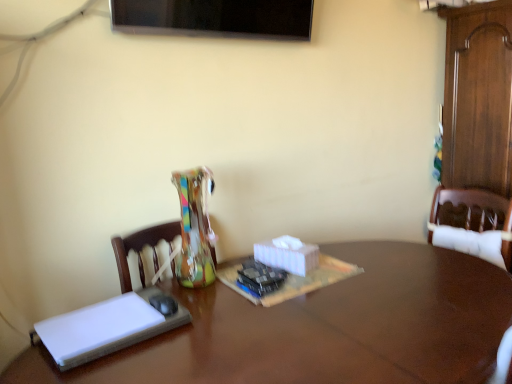
This screenshot has width=512, height=384. Find the location of `empty space that is ontop of white matte book at left (from a real-world perspective)`. empty space that is ontop of white matte book at left (from a real-world perspective) is located at coordinates (113, 319).